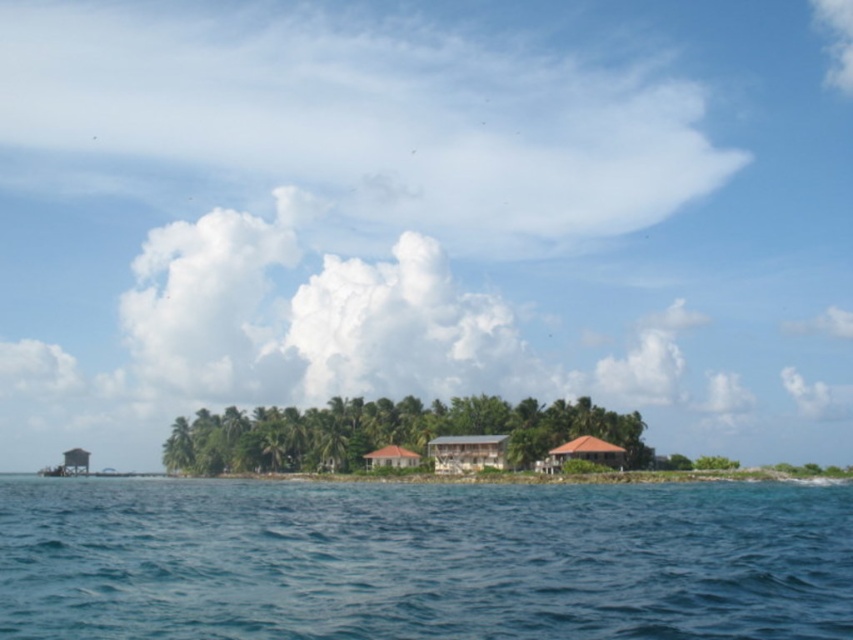
You are a photographer planning to capture a landscape shot of the blue water at lower center and the brown corrugated metal hut at center. Based on their heights, which object would appear larger in the photo?

The blue water at lower center appears larger in the photo because it has a greater height compared to the brown corrugated metal hut at center.

You are standing on the beach of the tropical island and see a point marked at coordinates (467, 452). What object is located at that point?

The brown wooden hut at center is located at the point marked by coordinates (467, 452).

You are standing on the tropical island and want to place a small garden statue exactly halfway between point (496,465) and point (396,465). Which point is closer to you so I can ensure the statue is centered correctly?

Point (496,465) is closer to the viewer than point (396,465). To center the statue between them, place it closer to the point that is farther away, which is point (396,465).